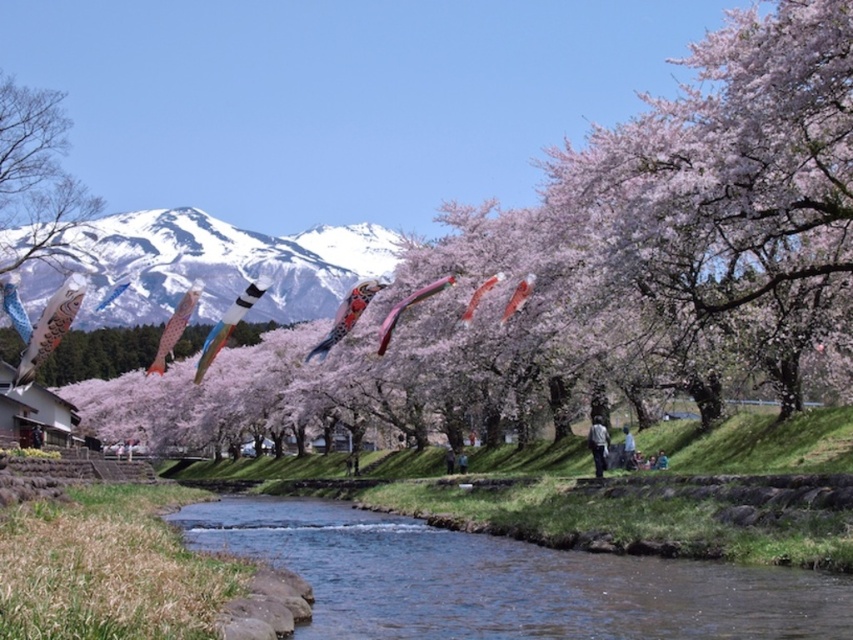
You are a kite enthusiast observing two kites flying in the serene cherry blossom scene. The kites are the matte blue kite at left and the shiny red kite at center. Which kite is positioned higher in the sky?

The matte blue kite at left is taller than the shiny red kite at center, so it is positioned higher in the sky.

You are an artist planning to paint the scene. You need to decide which object to paint first based on their sizes. Which object should you start with, the snowy white mountain at upper center or the shiny red kite at center?

The snowy white mountain at upper center should be painted first because its width is greater than the shiny red kite at center, making it a larger element in the composition.

You are a photographer standing at the riverside and want to capture a photo that includes both the snowy white mountain at upper center and the shiny red kite at center. Based on their positions, which object should you adjust your camera angle to focus on first to ensure both are in the frame?

The snowy white mountain at upper center is to the left of the shiny red kite at center, so you should adjust your camera angle to focus on the snowy white mountain at upper center first to ensure both are in the frame.